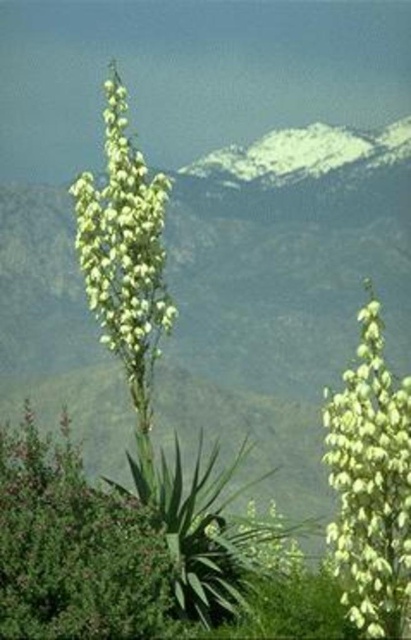
Question: Does white matte flower at right appear under green leafy plant at center?

Choices:
 (A) no
 (B) yes

Answer: (B)

Question: Which object is the closest to the green leafy bush at center?

Choices:
 (A) green leafy plant at center
 (B) white matte flower at right

Answer: (A)

Question: Which object appears farthest from the camera in this image?

Choices:
 (A) green leafy plant at center
 (B) white matte flower at right
 (C) green leafy bush at center

Answer: (A)

Question: From the image, what is the correct spatial relationship of green leafy bush at center in relation to green leafy plant at center?

Choices:
 (A) below
 (B) above

Answer: (A)

Question: Which of the following is the farthest from the observer?

Choices:
 (A) (381, 458)
 (B) (156, 173)

Answer: (B)

Question: Considering the relative positions of white matte flower at right and green leafy plant at center in the image provided, where is white matte flower at right located with respect to green leafy plant at center?

Choices:
 (A) above
 (B) below

Answer: (B)